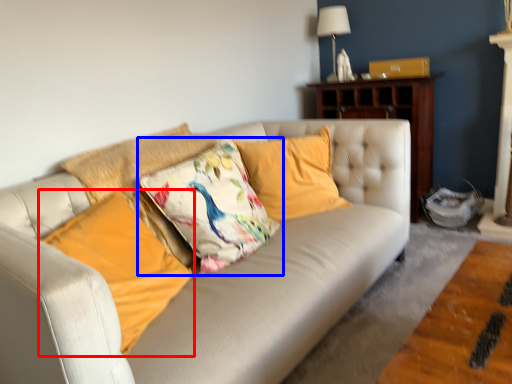
Question: Which object appears closest to the camera in this image, pillow (highlighted by a red box) or pillow (highlighted by a blue box)?

Choices:
 (A) pillow
 (B) pillow

Answer: (A)